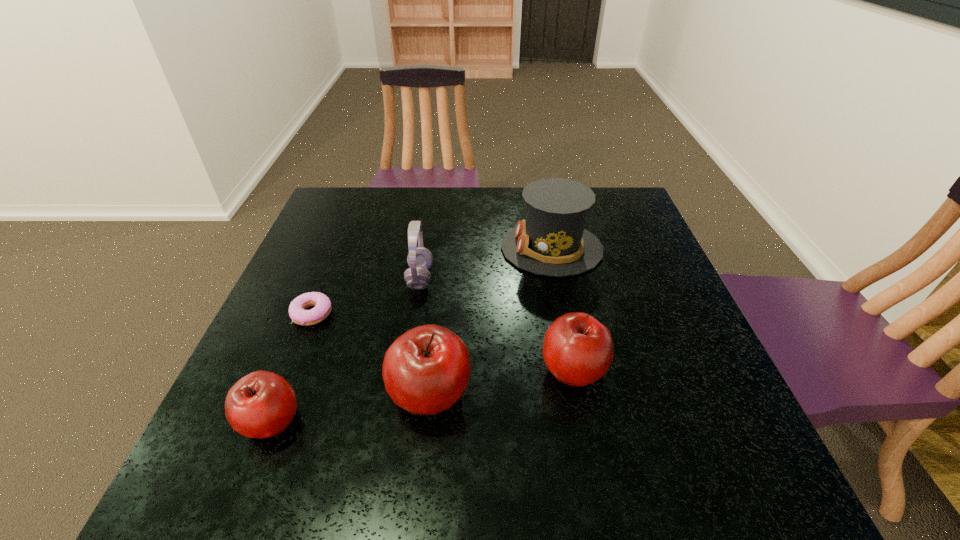
Identify the location of free space that is in between the shortest object and the second apple from right to left. (371, 354).

In order to click on empty space that is in between the dress hat and the headset in this screenshot , I will do `click(486, 263)`.

Where is `free spot between the dress hat and the second apple from right to left`? This screenshot has height=540, width=960. free spot between the dress hat and the second apple from right to left is located at coordinates (491, 321).

In order to click on free area in between the rightmost apple and the headset in this screenshot , I will do `click(496, 323)`.

The image size is (960, 540). Find the location of `empty location between the headset and the second shortest object`. empty location between the headset and the second shortest object is located at coordinates (346, 349).

Where is `vacant space that's between the rightmost apple and the dress hat`? This screenshot has width=960, height=540. vacant space that's between the rightmost apple and the dress hat is located at coordinates (563, 309).

This screenshot has height=540, width=960. In order to click on vacant point located between the second apple from right to left and the shortest apple in this screenshot , I will do `click(350, 407)`.

Image resolution: width=960 pixels, height=540 pixels. In order to click on object that ranks as the fourth closest to the headset in this screenshot , I will do `click(578, 350)`.

Point out which object is positioned as the fourth nearest to the second apple from right to left. Please provide its 2D coordinates. Your answer should be formatted as a tuple, i.e. [(x, y)], where the tuple contains the x and y coordinates of a point satisfying the conditions above.

[(420, 259)]

Where is `the second closest apple to the doughnut`? The height and width of the screenshot is (540, 960). the second closest apple to the doughnut is located at coordinates (425, 371).